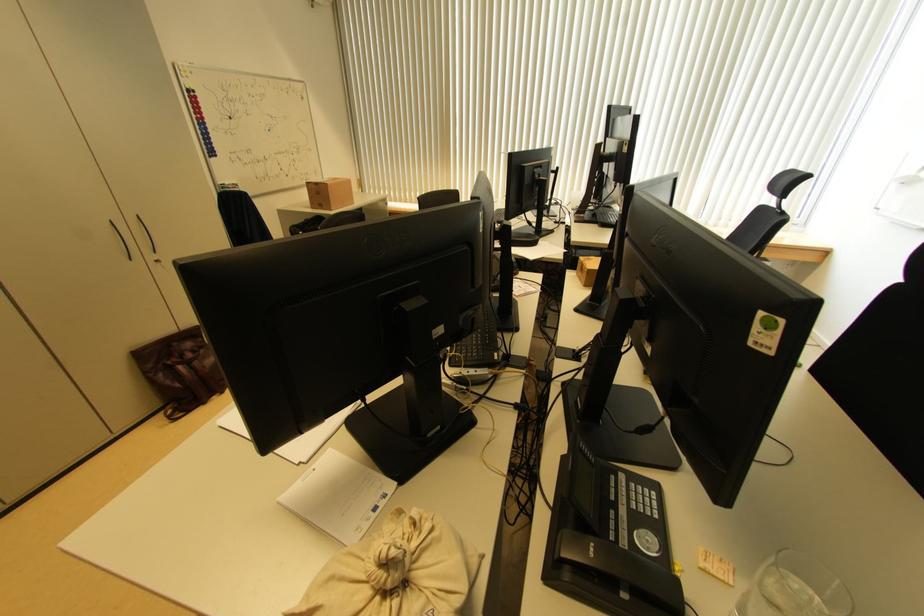
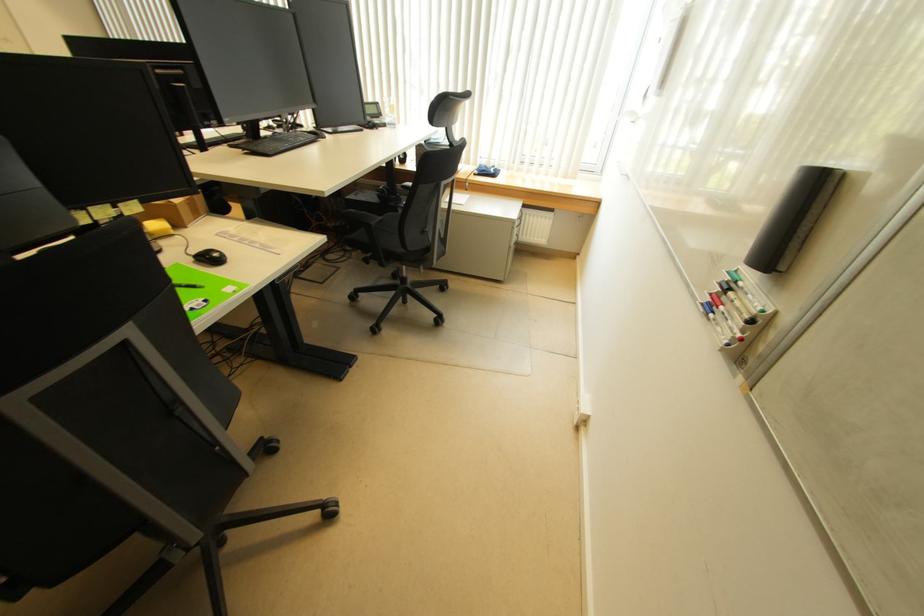
Question: What movement of the cameraman would produce the second image?

Choices:
 (A) Left
 (B) Right
 (C) Forward
 (D) Backward

Answer: (B)